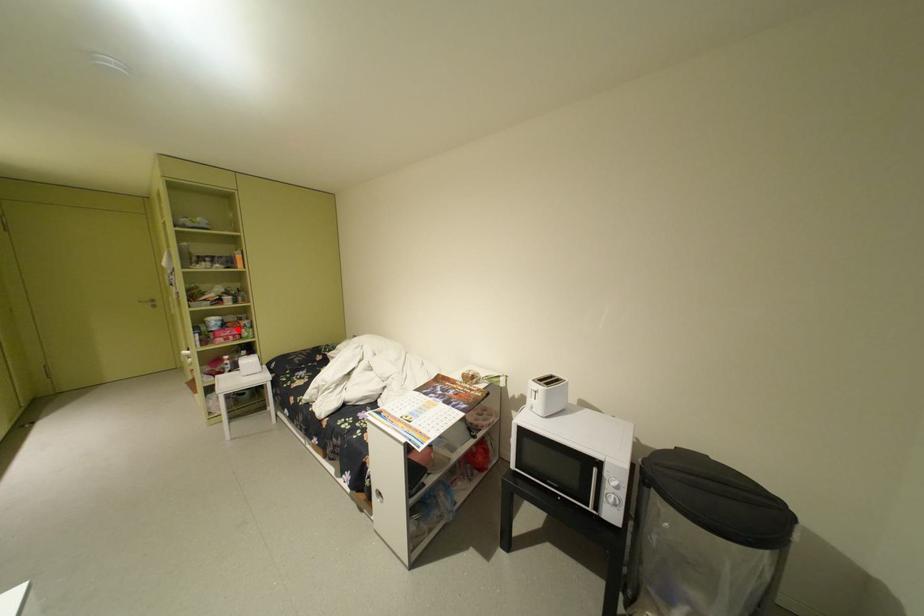
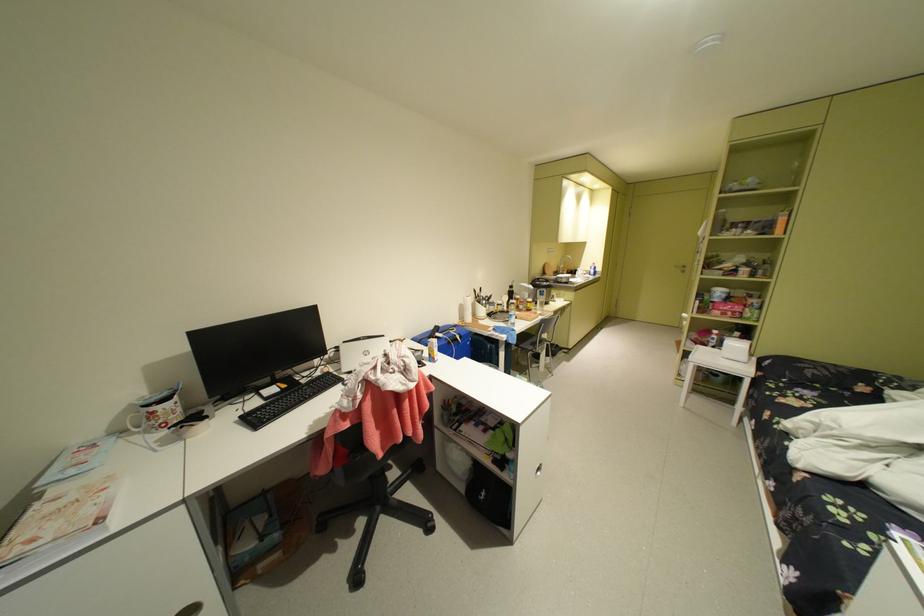
The point at the highlighted location is marked in the first image. Where is the corresponding point in the second image?

(740, 304)